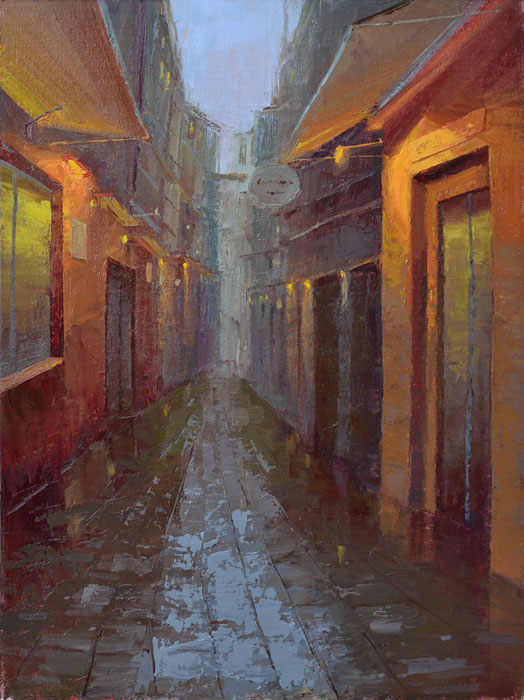
Find the location of a particular element. window is located at coordinates (4, 274), (36, 272).